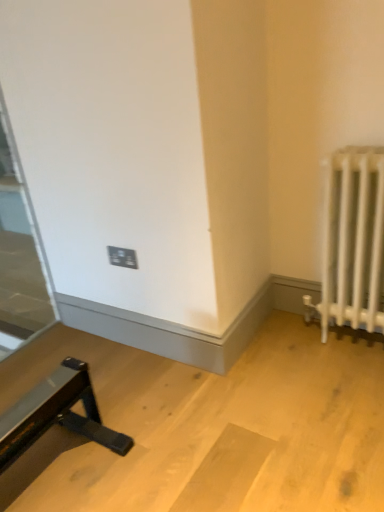
You are a GUI agent. You are given a task and a screenshot of the screen. Output one action in this format:
    pyautogui.click(x=<x>, y=<y>)
    Task: Click on the free point to the right of transparent glass door at left
    This screenshot has width=384, height=512.
    Given the screenshot: What is the action you would take?
    pyautogui.click(x=69, y=339)